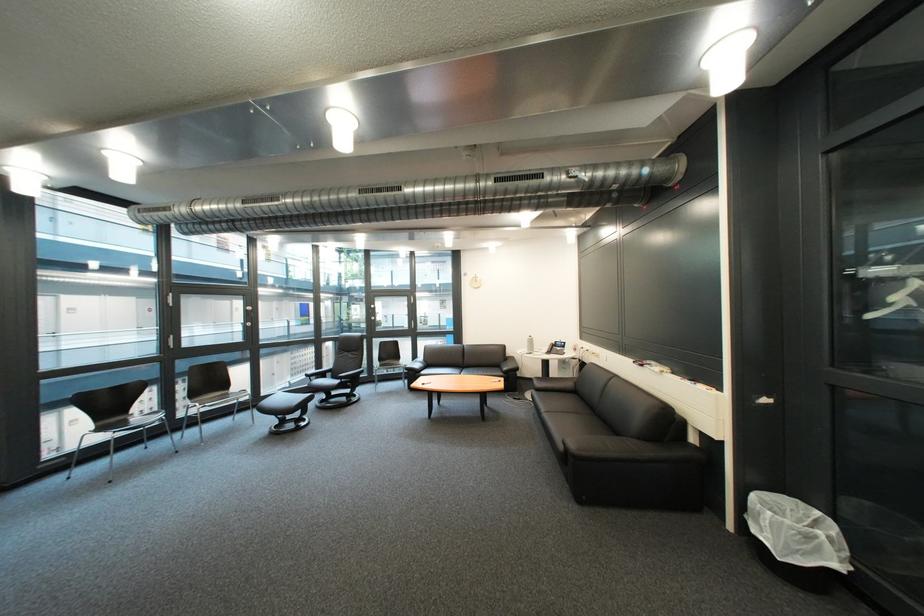
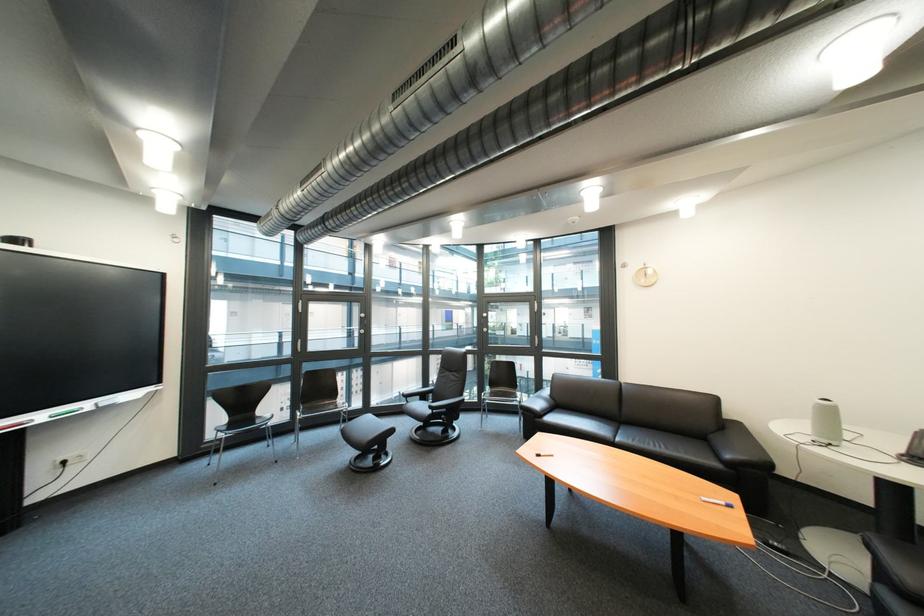
Where in the second image is the point corresponding to [518,371] from the first image?

(742, 458)